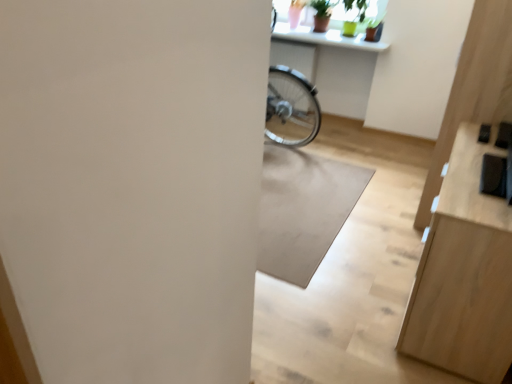
Question: Can you confirm if white matte mat at center is thinner than light wood dresser at right?

Choices:
 (A) yes
 (B) no

Answer: (B)

Question: Can you see white matte mat at center touching light wood dresser at right?

Choices:
 (A) yes
 (B) no

Answer: (B)

Question: Could light wood dresser at right be considered to be inside white matte mat at center?

Choices:
 (A) yes
 (B) no

Answer: (B)

Question: Is white matte mat at center located outside light wood dresser at right?

Choices:
 (A) yes
 (B) no

Answer: (A)

Question: Is white matte mat at center to the right of light wood dresser at right from the viewer's perspective?

Choices:
 (A) no
 (B) yes

Answer: (A)

Question: From a real-world perspective, does white matte mat at center sit lower than light wood dresser at right?

Choices:
 (A) no
 (B) yes

Answer: (B)

Question: Is white glossy counter top at upper center surrounded by light wood dresser at right?

Choices:
 (A) yes
 (B) no

Answer: (B)

Question: From the image's perspective, is light wood dresser at right below white glossy counter top at upper center?

Choices:
 (A) yes
 (B) no

Answer: (A)

Question: Can you confirm if light wood dresser at right is bigger than white glossy counter top at upper center?

Choices:
 (A) no
 (B) yes

Answer: (B)

Question: Considering the relative sizes of light wood dresser at right and white glossy counter top at upper center in the image provided, is light wood dresser at right wider than white glossy counter top at upper center?

Choices:
 (A) yes
 (B) no

Answer: (A)

Question: Is light wood dresser at right in front of white glossy counter top at upper center?

Choices:
 (A) no
 (B) yes

Answer: (B)

Question: Are light wood dresser at right and white glossy counter top at upper center located far from each other?

Choices:
 (A) no
 (B) yes

Answer: (B)

Question: From a real-world perspective, is white glossy counter top at upper center on top of light wood dresser at right?

Choices:
 (A) no
 (B) yes

Answer: (B)